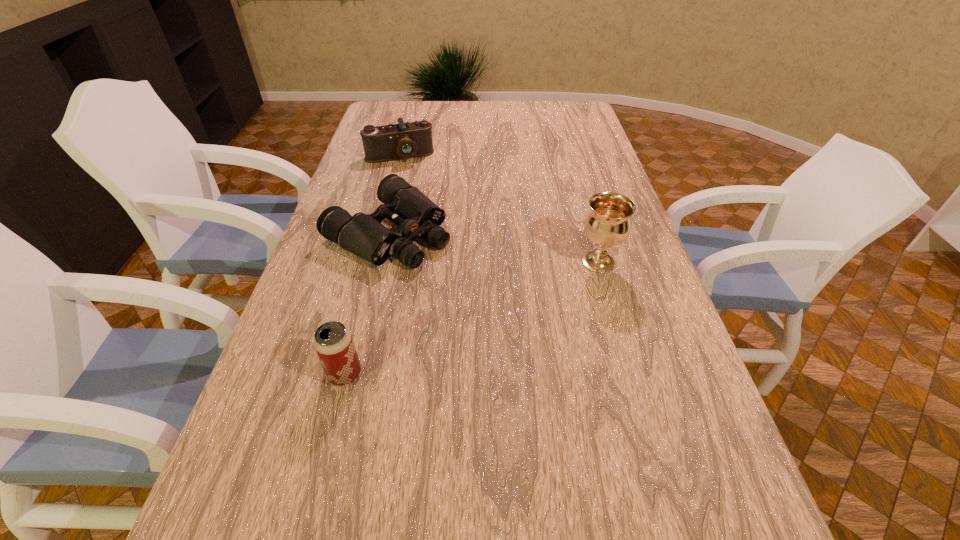
Image resolution: width=960 pixels, height=540 pixels. What are the coordinates of `the nearest object` in the screenshot? It's located at (333, 342).

I want to click on chalice, so tap(607, 224).

What are the coordinates of `the tallest object` in the screenshot? It's located at (607, 224).

Locate an element on the screen. The image size is (960, 540). binoculars is located at coordinates (416, 215).

Find the location of a particular element. the farthest object is located at coordinates (391, 142).

In order to click on vacant region located on the right of the nearest object in this screenshot , I will do `click(437, 374)`.

Locate an element on the screen. free region located on the front of the tallest object is located at coordinates (632, 377).

The height and width of the screenshot is (540, 960). I want to click on blank space located through the eyepieces of the binoculars, so click(x=508, y=298).

Identify the location of blank space located 0.110m through the eyepieces of the binoculars. (466, 274).

The width and height of the screenshot is (960, 540). Identify the location of vacant space located through the eyepieces of the binoculars. (477, 280).